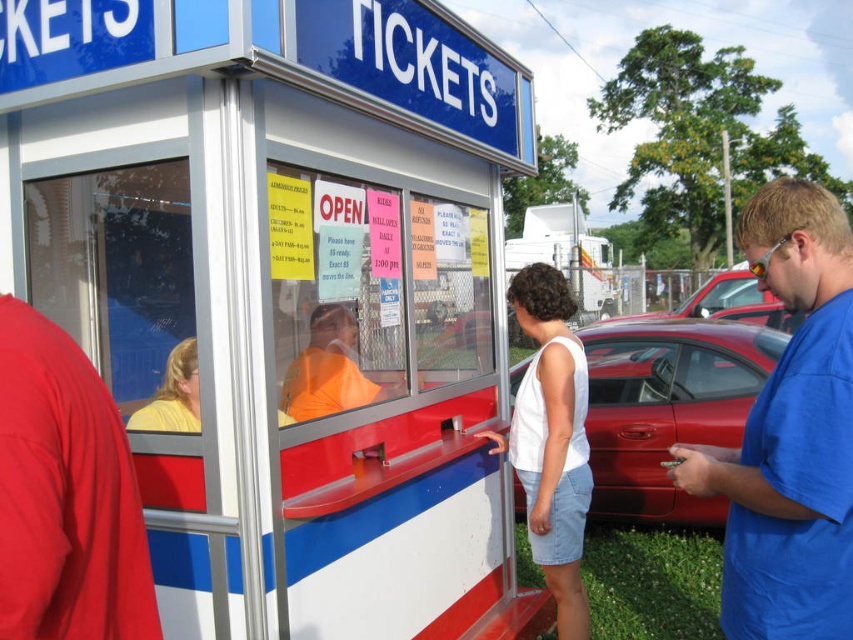
You are at the ticket booth and notice a shiny red car at center and an orange shirt at center. Which object is positioned more to the right?

The shiny red car at center is positioned to the right of the orange shirt at center.

You are standing in front of the ticket booth and notice two items in the scene. One is a blue cotton shirt at right and the other is a shiny red car at center. Which of these two items is smaller in size?

The blue cotton shirt at right is smaller than the shiny red car at center.